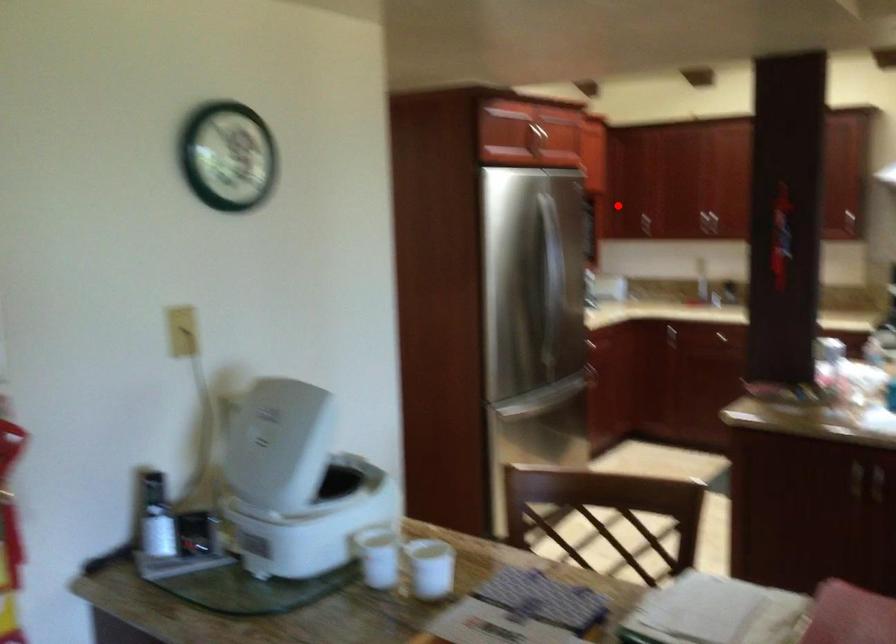
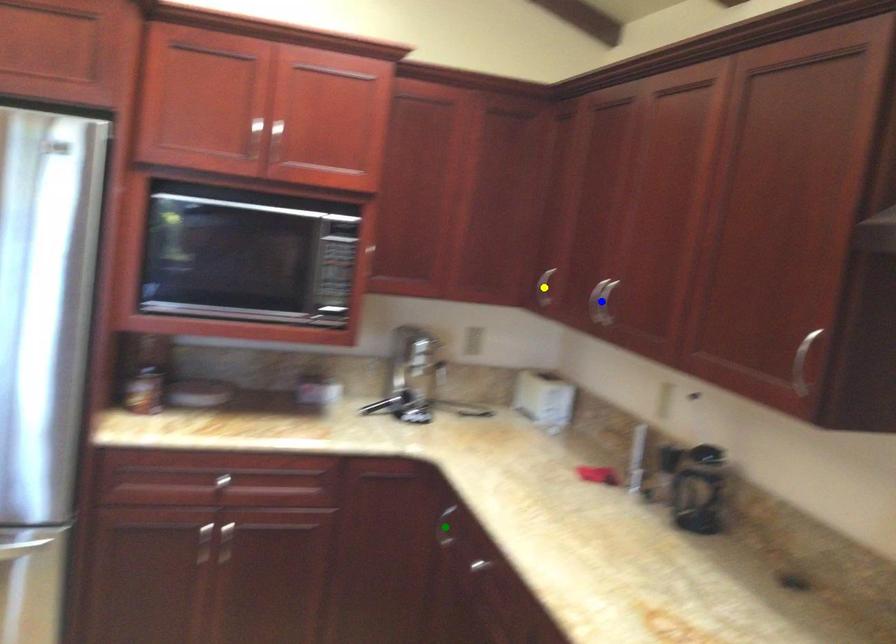
Question: I am providing you with two images of the same scene from different viewpoints. A red point is marked on the first image. You are given multiple points on the second image. Can you choose the point in image 2 that corresponds to the point in image 1?

Choices:
 (A) yellow point
 (B) green point
 (C) blue point

Answer: (A)